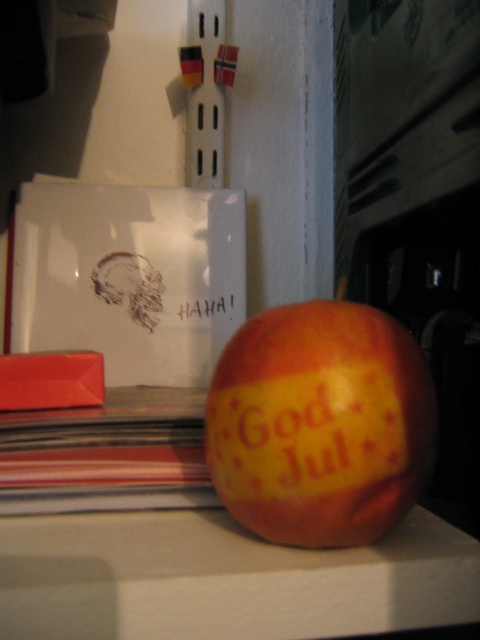
Between red matte apple at center and yellow matte text at center, which one is positioned higher?

yellow matte text at center

Between point (239, 364) and point (217, 300), which one is positioned in front?

Positioned in front is point (239, 364).

The height and width of the screenshot is (640, 480). Find the location of `red matte apple at center`. red matte apple at center is located at coordinates (320, 422).

Locate an element on the screen. This screenshot has width=480, height=640. red matte apple at center is located at coordinates (320, 422).